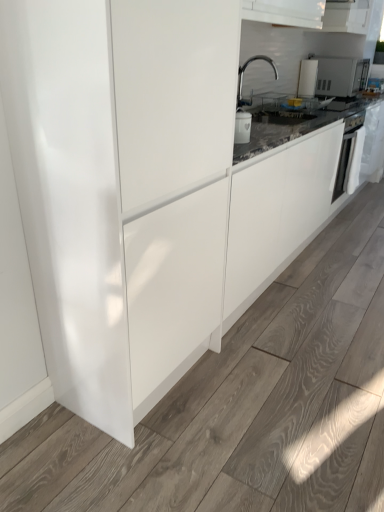
Identify the location of vacant area on the back side of polished chrome faucet at upper center. This screenshot has width=384, height=512. [x=252, y=105].